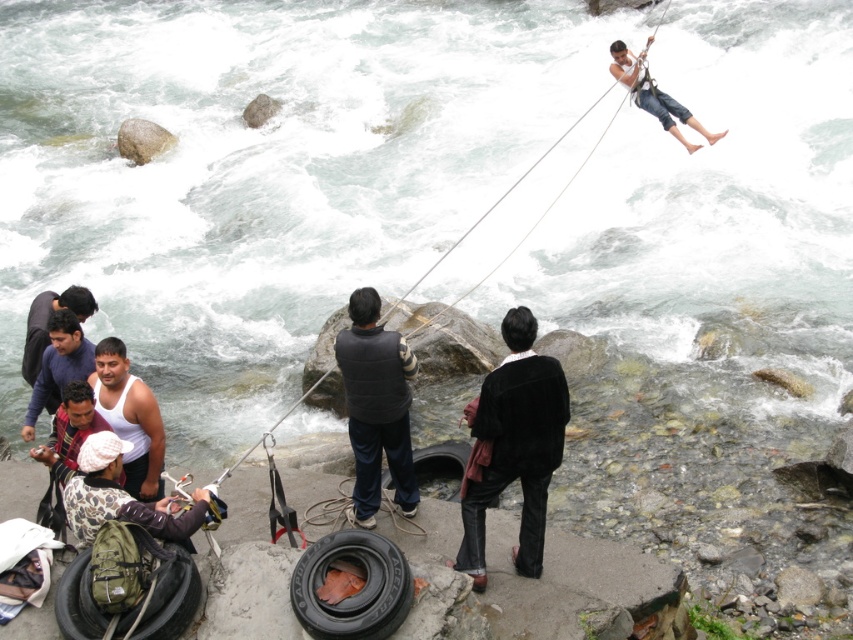
Can you confirm if black fleece vest at center is positioned to the right of black rubber tire at lower center?

Yes, black fleece vest at center is to the right of black rubber tire at lower center.

Describe the element at coordinates (376, 406) in the screenshot. I see `black fleece vest at center` at that location.

Who is more forward, (363, 496) or (396, 586)?

Point (396, 586) is more forward.

Find the location of a particular element. This screenshot has width=853, height=640. black fleece vest at center is located at coordinates (376, 406).

Does black rubber tire at lower center appear on the right side of black rubber tire at lower left?

Correct, you'll find black rubber tire at lower center to the right of black rubber tire at lower left.

Consider the image. Is the position of black rubber tire at lower center more distant than that of black rubber tire at lower left?

No, it is in front of black rubber tire at lower left.

The image size is (853, 640). I want to click on black rubber tire at lower center, so click(x=352, y=593).

The image size is (853, 640). Identify the location of black rubber tire at lower center. (352, 593).

Is black suede jacket at center bigger than white matte tank top at lower left?

Correct, black suede jacket at center is larger in size than white matte tank top at lower left.

Describe the element at coordinates (515, 445) in the screenshot. The height and width of the screenshot is (640, 853). I see `black suede jacket at center` at that location.

Which is behind, point (526, 451) or point (120, 364)?

The point (120, 364) is behind.

Find the location of a particular element. This screenshot has width=853, height=640. black suede jacket at center is located at coordinates 515,445.